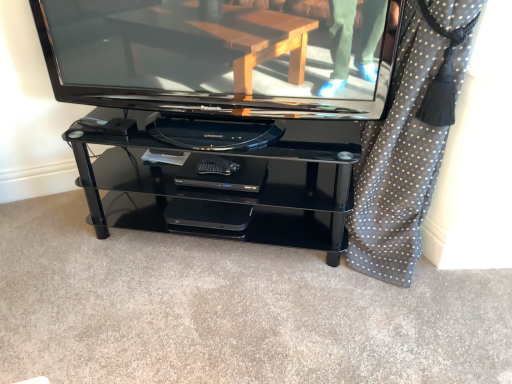
In order to click on free space in front of polka dot fabric at right in this screenshot , I will do pyautogui.click(x=439, y=338).